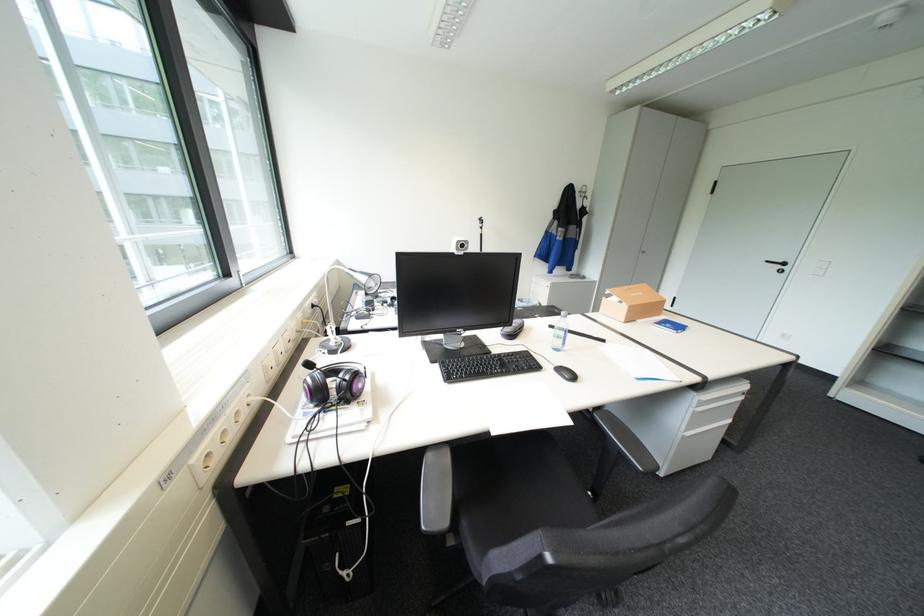
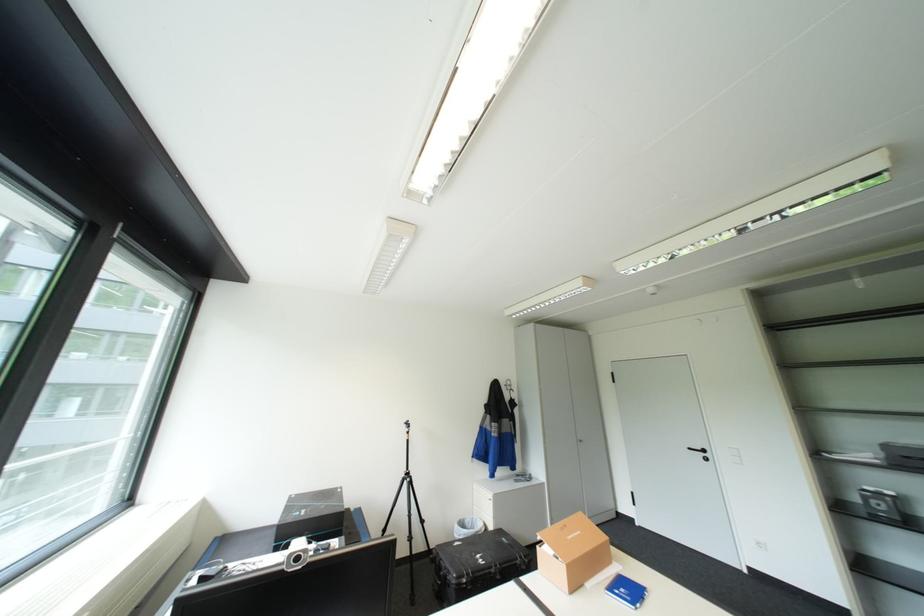
In the second image, find the point that corresponds to [667,322] in the first image.

(619, 588)